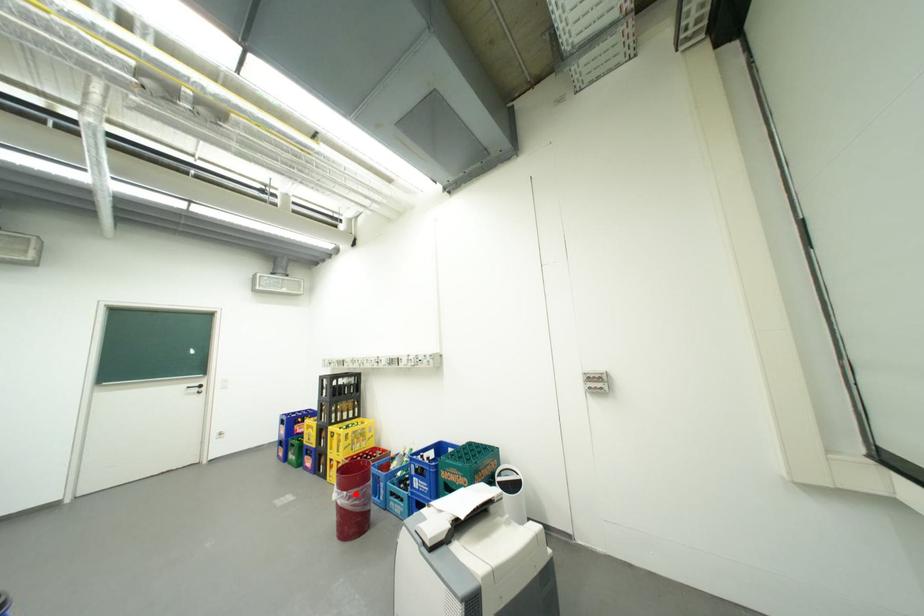
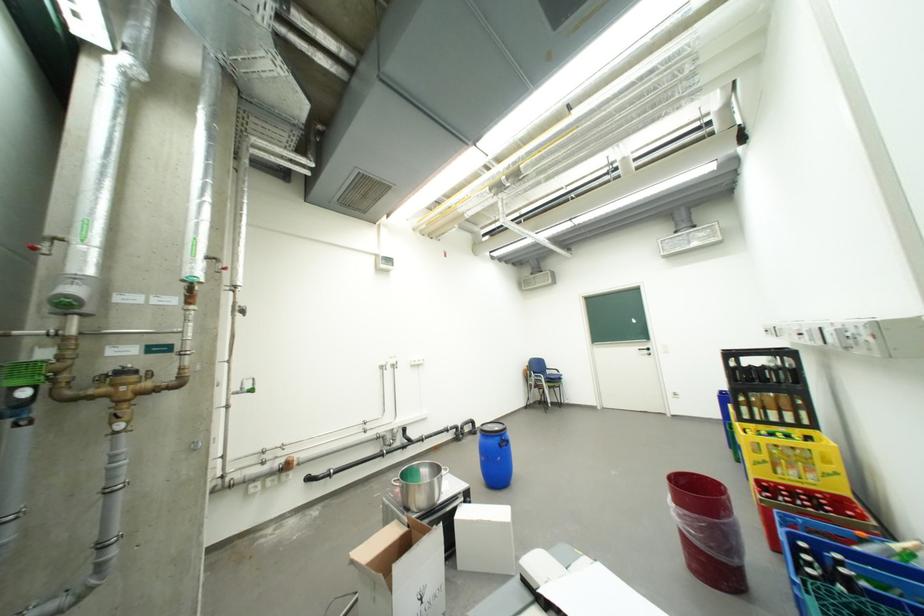
In the second image, find the point that corresponds to the highlighted location in the first image.

(685, 507)